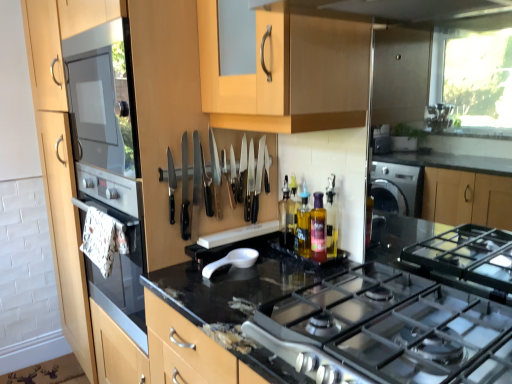
Where is `free space in front of translucent purple bottle at center, which is counted as the 2th bottle, starting from the back`? free space in front of translucent purple bottle at center, which is counted as the 2th bottle, starting from the back is located at coordinates (302, 277).